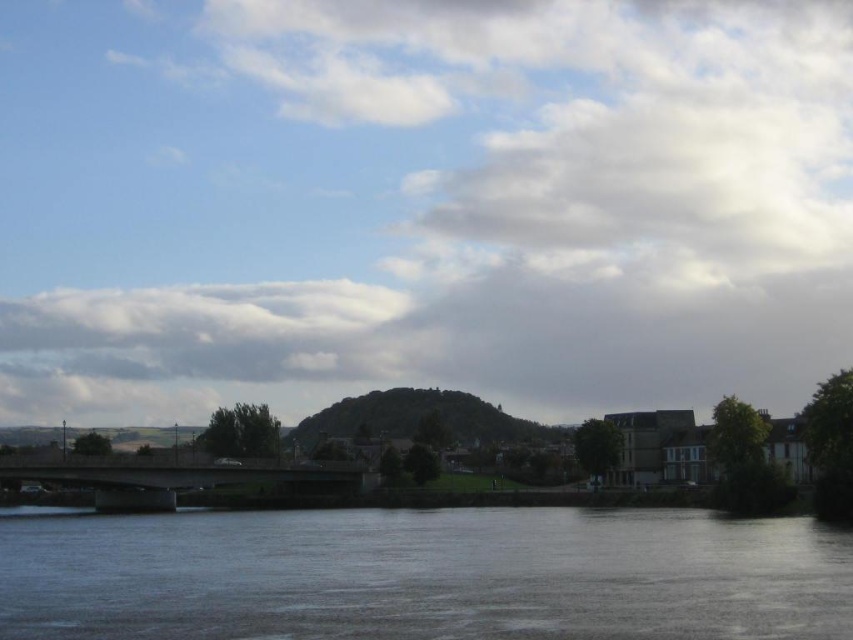
Question: From the image, what is the correct spatial relationship of cloudy sky at center in relation to smooth gray water at lower center?

Choices:
 (A) left
 (B) right

Answer: (A)

Question: Among these points, which one is nearest to the camera?

Choices:
 (A) (805, 285)
 (B) (601, 532)

Answer: (B)

Question: Can you confirm if cloudy sky at center is positioned below smooth gray water at lower center?

Choices:
 (A) no
 (B) yes

Answer: (A)

Question: Can you confirm if cloudy sky at center is thinner than smooth gray water at lower center?

Choices:
 (A) no
 (B) yes

Answer: (A)